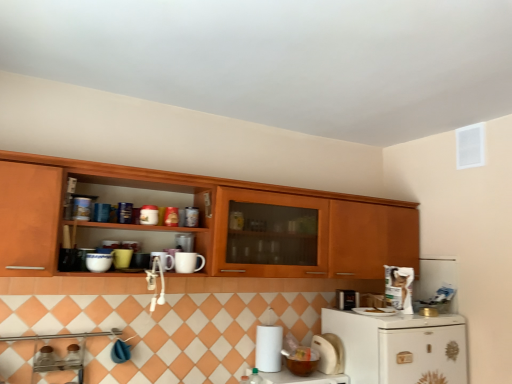
Question: Can you confirm if white matte mug at upper center, the 5th appliance in the right-to-left sequence, is wider than matte brown bowl at lower center, which appears as the 7th appliance when viewed from the left?

Choices:
 (A) no
 (B) yes

Answer: (A)

Question: Considering the relative sizes of white matte mug at upper center, the 5th appliance in the right-to-left sequence, and matte brown bowl at lower center, which appears as the 7th appliance when viewed from the left, in the image provided, is white matte mug at upper center, the 5th appliance in the right-to-left sequence, smaller than matte brown bowl at lower center, which appears as the 7th appliance when viewed from the left,?

Choices:
 (A) no
 (B) yes

Answer: (B)

Question: Considering the relative sizes of white matte mug at upper center, arranged as the sixth appliance when viewed from the left, and matte brown bowl at lower center, placed as the 4th appliance when sorted from right to left, in the image provided, is white matte mug at upper center, arranged as the sixth appliance when viewed from the left, thinner than matte brown bowl at lower center, placed as the 4th appliance when sorted from right to left,?

Choices:
 (A) no
 (B) yes

Answer: (B)

Question: From the image's perspective, is white matte mug at upper center, arranged as the sixth appliance when viewed from the left, on matte brown bowl at lower center, which appears as the 7th appliance when viewed from the left?

Choices:
 (A) yes
 (B) no

Answer: (A)

Question: From a real-world perspective, is white matte mug at upper center, arranged as the sixth appliance when viewed from the left, positioned over matte brown bowl at lower center, which appears as the 7th appliance when viewed from the left, based on gravity?

Choices:
 (A) yes
 (B) no

Answer: (A)

Question: Does white matte mug at upper center, arranged as the sixth appliance when viewed from the left, turn towards matte brown bowl at lower center, placed as the 4th appliance when sorted from right to left?

Choices:
 (A) yes
 (B) no

Answer: (B)

Question: Is white glossy bowl at lower center further to camera compared to white glossy canister at upper center, which ranks as the 8th appliance in right-to-left order?

Choices:
 (A) no
 (B) yes

Answer: (B)

Question: Is white glossy bowl at lower center oriented away from white glossy canister at upper center, which is the 3th appliance from left to right?

Choices:
 (A) no
 (B) yes

Answer: (A)

Question: Can we say white glossy bowl at lower center lies outside white glossy canister at upper center, which ranks as the 8th appliance in right-to-left order?

Choices:
 (A) yes
 (B) no

Answer: (A)

Question: Can you confirm if white glossy bowl at lower center is wider than white glossy canister at upper center, which ranks as the 8th appliance in right-to-left order?

Choices:
 (A) no
 (B) yes

Answer: (B)

Question: Does white glossy bowl at lower center have a lesser height compared to white glossy canister at upper center, which ranks as the 8th appliance in right-to-left order?

Choices:
 (A) no
 (B) yes

Answer: (A)

Question: Is white glossy bowl at lower center bigger than white glossy canister at upper center, which is the 3th appliance from left to right?

Choices:
 (A) no
 (B) yes

Answer: (B)

Question: Is the position of white glossy refrigerator at lower right more distant than that of white matte paper towel at lower center?

Choices:
 (A) no
 (B) yes

Answer: (A)